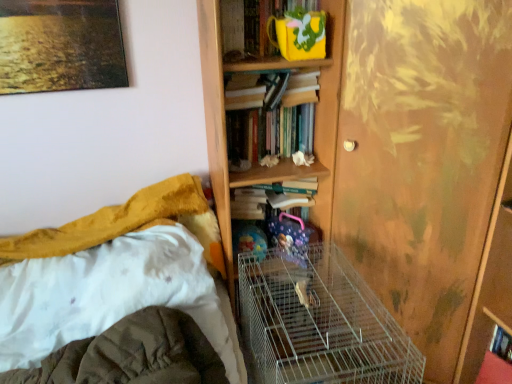
Question: Are hardcover book at center, the third book in the top-to-bottom sequence, and white fabric bed at lower left far apart?

Choices:
 (A) no
 (B) yes

Answer: (A)

Question: Is hardcover book at center, the third book in the top-to-bottom sequence, closer to camera compared to white fabric bed at lower left?

Choices:
 (A) no
 (B) yes

Answer: (A)

Question: From a real-world perspective, is hardcover book at center, the third book in the top-to-bottom sequence, physically above white fabric bed at lower left?

Choices:
 (A) yes
 (B) no

Answer: (A)

Question: Is hardcover book at center, the third book in the top-to-bottom sequence, not inside white fabric bed at lower left?

Choices:
 (A) yes
 (B) no

Answer: (A)

Question: Is hardcover book at center, the third book in the top-to-bottom sequence, at the left side of white fabric bed at lower left?

Choices:
 (A) yes
 (B) no

Answer: (B)

Question: Does hardcover book at center, the first book positioned from the bottom, have a lesser width compared to white fabric bed at lower left?

Choices:
 (A) no
 (B) yes

Answer: (B)

Question: Is white fabric bed at lower left in front of wooden bookcase at upper center?

Choices:
 (A) no
 (B) yes

Answer: (B)

Question: Can you confirm if white fabric bed at lower left is positioned to the right of wooden bookcase at upper center?

Choices:
 (A) yes
 (B) no

Answer: (B)

Question: Is white fabric bed at lower left facing away from wooden bookcase at upper center?

Choices:
 (A) no
 (B) yes

Answer: (A)

Question: Could wooden bookcase at upper center be considered to be inside white fabric bed at lower left?

Choices:
 (A) yes
 (B) no

Answer: (B)

Question: Is white fabric bed at lower left at the left side of wooden bookcase at upper center?

Choices:
 (A) yes
 (B) no

Answer: (A)

Question: Can you confirm if white fabric bed at lower left is bigger than wooden bookcase at upper center?

Choices:
 (A) yes
 (B) no

Answer: (A)

Question: Does hardcover books at center, which ranks as the second book in top-to-bottom order, have a smaller size compared to silver wire birdcage at center?

Choices:
 (A) yes
 (B) no

Answer: (A)